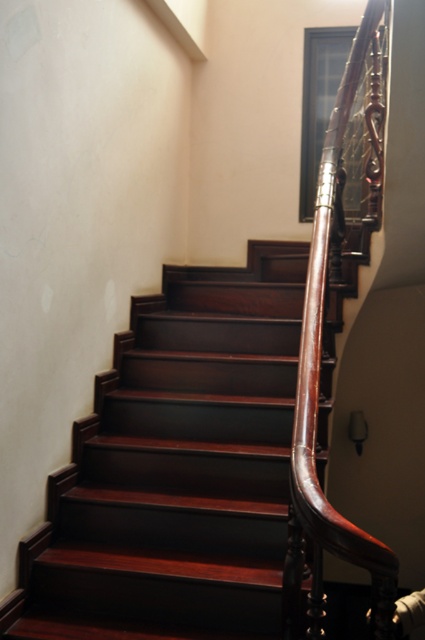
Does mahogany wood stairs at center have a lesser width compared to mahogany wood handrail at upper right?

No.

What do you see at coordinates (178, 468) in the screenshot?
I see `mahogany wood stairs at center` at bounding box center [178, 468].

You are a GUI agent. You are given a task and a screenshot of the screen. Output one action in this format:
    pyautogui.click(x=<x>, y=<y>)
    Task: Click on the mahogany wood stairs at center
    Image resolution: width=425 pixels, height=640 pixels.
    Given the screenshot: What is the action you would take?
    pyautogui.click(x=178, y=468)